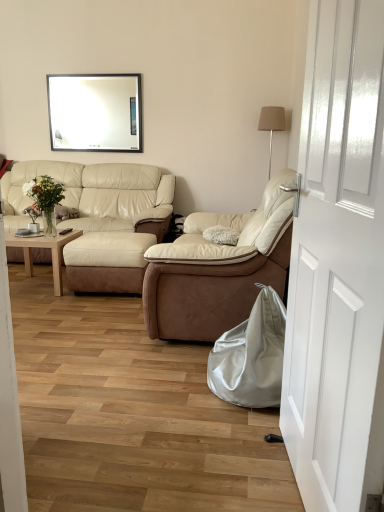
The image size is (384, 512). I want to click on vacant space positioned to the left of satin silver bean bag at lower right, so click(x=164, y=381).